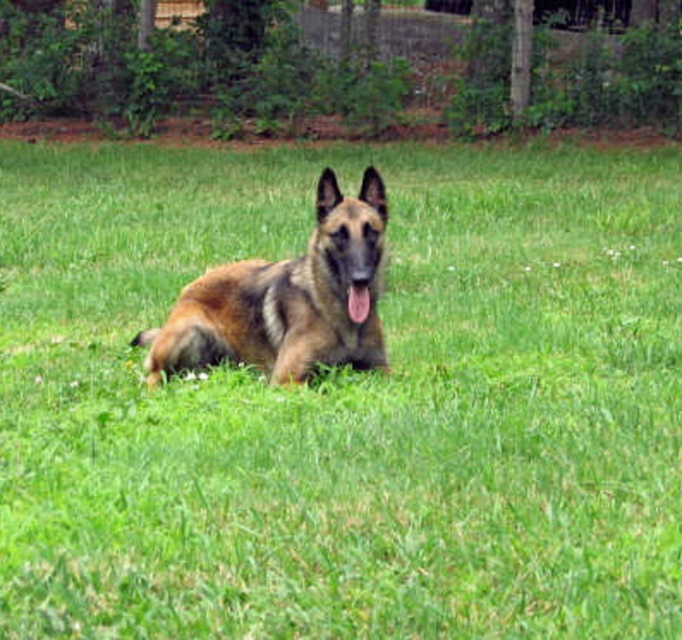
You are standing at the origin point of the coordinate system. You see a brown fur dog at center located at point (x=284, y=300). What is the exact coordinate of the brown fur dog at center?

The exact coordinate of the brown fur dog at center is point (x=284, y=300).

You are a veterinarian examining a German Shepherd dog lying on the lawn. You need to check the dog for any signs of distress. The dog has a brown fur dog at center and a pink glossy tongue at center. Which part is farther from you when observing the dog?

The brown fur dog at center is farther from you than the pink glossy tongue at center since the distance between them is 14.08 inches.

You are a photographer trying to capture the brown fur dog at center and the pink glossy tongue at center in a single shot. Since the camera can only focus on one subject at a time, which subject should you choose to ensure the other remains in the background? Explain your reasoning based on their sizes.

The brown fur dog at center is much taller than the pink glossy tongue at center. Therefore, focusing on the brown fur dog at center would keep the pink glossy tongue at center in the background since it is smaller and positioned lower.